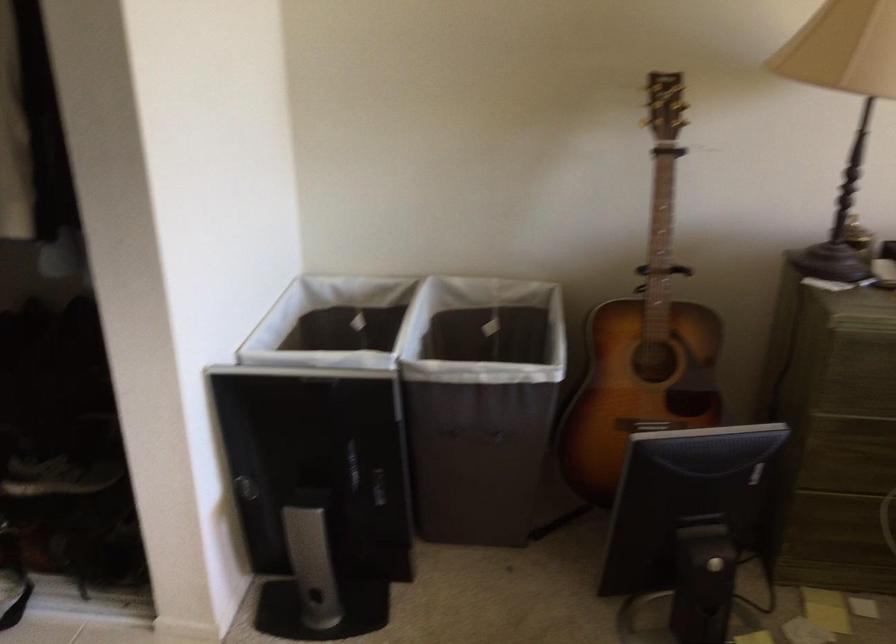
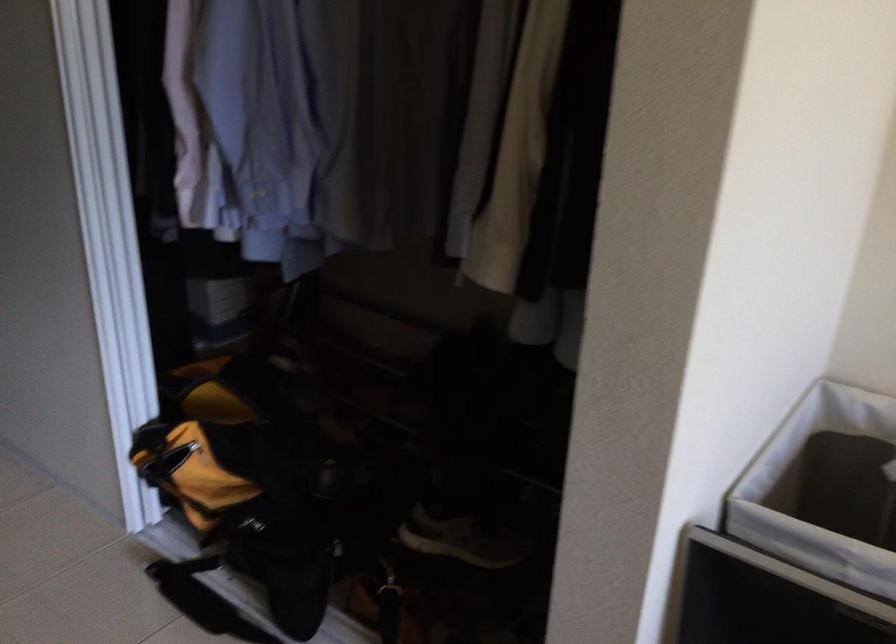
Locate, in the second image, the point that corresponds to point 323,346 in the first image.

(824, 489)